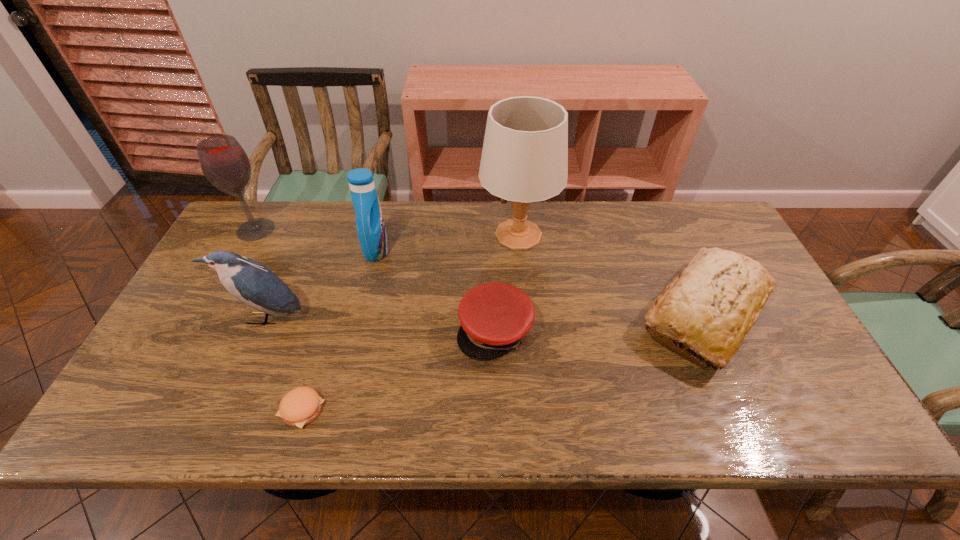
Locate an element on the screen. Image resolution: width=960 pixels, height=540 pixels. vacant space at the near right corner of the desktop is located at coordinates (802, 402).

Identify the location of empty location between the fourth tallest object and the nearest object. This screenshot has height=540, width=960. pos(283,364).

The image size is (960, 540). In order to click on empty location between the cap and the bird in this screenshot , I will do `click(380, 324)`.

At what (x,y) coordinates should I click in order to perform the action: click on vacant area that lies between the third shortest object and the alcohol. Please return your answer as a coordinate pair (x, y). Looking at the image, I should click on [480, 272].

The height and width of the screenshot is (540, 960). I want to click on vacant space that is in between the third shortest object and the table lamp, so 612,275.

Identify the location of free area in between the table lamp and the patty. (410, 322).

Locate an element on the screen. The height and width of the screenshot is (540, 960). free space between the alcohol and the tallest object is located at coordinates (387, 232).

Locate an element on the screen. The height and width of the screenshot is (540, 960). free space between the patty and the detergent is located at coordinates (339, 330).

You are a GUI agent. You are given a task and a screenshot of the screen. Output one action in this format:
    pyautogui.click(x=<x>, y=<y>)
    Task: Click on the free space between the sixth tallest object and the detergent
    The height and width of the screenshot is (540, 960).
    Given the screenshot: What is the action you would take?
    pyautogui.click(x=436, y=291)

You are a GUI agent. You are given a task and a screenshot of the screen. Output one action in this format:
    pyautogui.click(x=<x>, y=<y>)
    Task: Click on the empty space that is in between the third shortest object and the cap
    This screenshot has height=540, width=960.
    Given the screenshot: What is the action you would take?
    pyautogui.click(x=600, y=322)